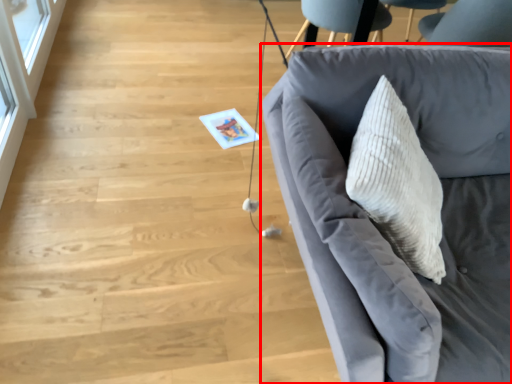
Question: From the image's perspective, what is the correct spatial relationship of studio couch (annotated by the red box) in relation to glass door?

Choices:
 (A) above
 (B) below

Answer: (B)